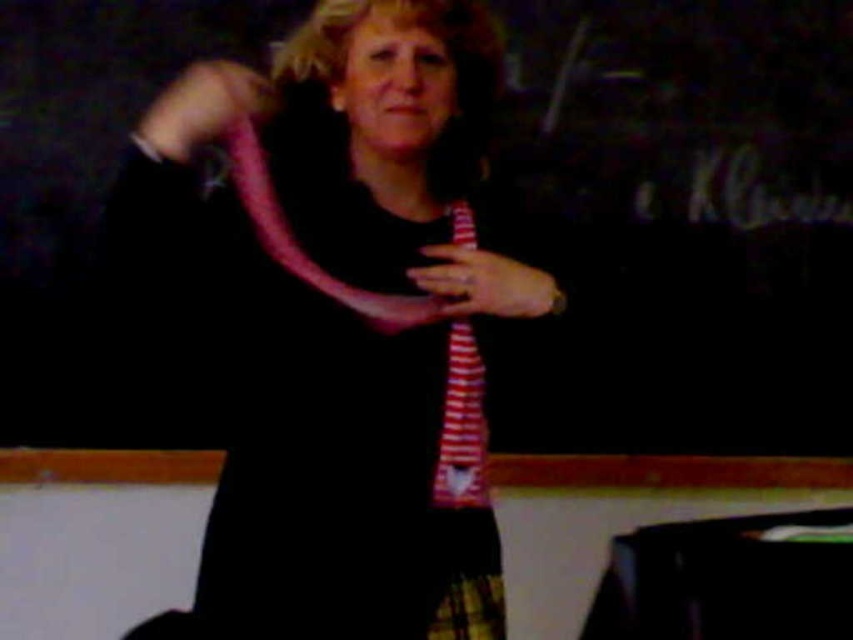
Question: Does black matte dress at center appear over pink striped scarf at upper center?

Choices:
 (A) no
 (B) yes

Answer: (A)

Question: Estimate the real-world distances between objects in this image. Which object is closer to the striped fabric tie at center?

Choices:
 (A) pink striped fabric at center
 (B) black matte dress at center
 (C) pink striped scarf at upper center

Answer: (A)

Question: Which object is the farthest from the black matte dress at center?

Choices:
 (A) pink striped fabric at center
 (B) striped fabric tie at center
 (C) pink striped scarf at upper center

Answer: (C)

Question: Is black matte dress at center closer to the viewer compared to striped fabric tie at center?

Choices:
 (A) yes
 (B) no

Answer: (A)

Question: Based on their relative distances, which object is farther from the pink striped scarf at upper center?

Choices:
 (A) striped fabric tie at center
 (B) black matte dress at center

Answer: (A)

Question: Does striped fabric tie at center have a smaller size compared to pink striped scarf at upper center?

Choices:
 (A) no
 (B) yes

Answer: (A)